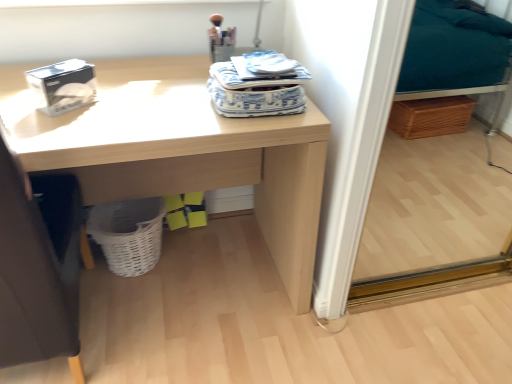
The height and width of the screenshot is (384, 512). What are the coordinates of `vacant space underneath light wood desk at center (from a real-world perspective)` in the screenshot? It's located at (196, 274).